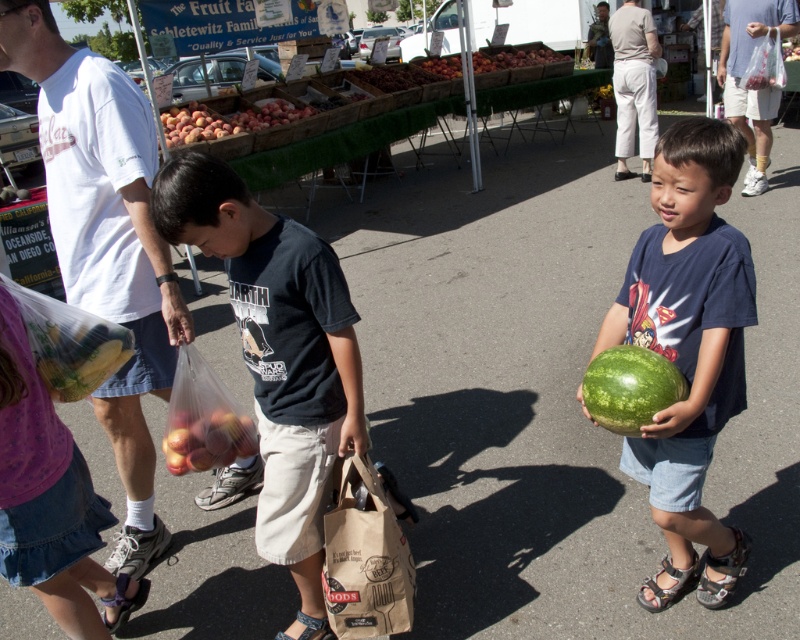
Question: Which point appears farthest from the camera in this image?

Choices:
 (A) (738, 556)
 (B) (189, 465)

Answer: (B)

Question: Which of these objects is positioned closest to the brown paper bag at lower center?

Choices:
 (A) green matte watermelon at right
 (B) shiny red apples at lower left

Answer: (B)

Question: Which of these objects is positioned closest to the green textured sandal at lower right?

Choices:
 (A) dark blue t-shirt at center
 (B) shiny red apples at lower left
 (C) multicolored fabric sandal at lower right

Answer: (C)

Question: Is brown paper bag at lower center positioned in front of brown fabric sandal at lower left?

Choices:
 (A) no
 (B) yes

Answer: (B)

Question: Does green matte watermelon at right have a larger size compared to brown fabric sandal at lower left?

Choices:
 (A) yes
 (B) no

Answer: (A)

Question: Can you confirm if green matte watermelon at right is positioned below dark blue t-shirt at center?

Choices:
 (A) yes
 (B) no

Answer: (B)